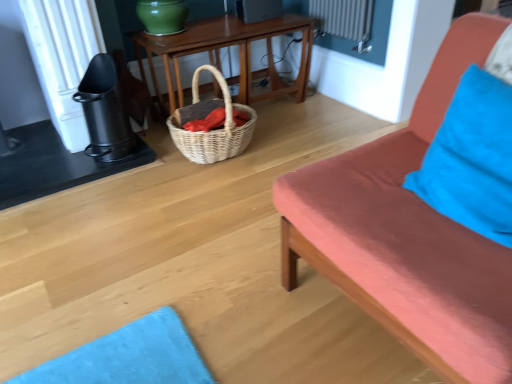
You are a GUI agent. You are given a task and a screenshot of the screen. Output one action in this format:
    pyautogui.click(x=<x>, y=<y>)
    Task: Click on the woven wicker basket at center
    The height and width of the screenshot is (384, 512).
    Given the screenshot: What is the action you would take?
    pyautogui.click(x=203, y=117)

Find the location of a particular element. woven natural picnic basket at center is located at coordinates (214, 131).

At what (x,y) coordinates should I click in order to perform the action: click on woven wood table at center. Please return your answer as a coordinate pair (x, y). The width and height of the screenshot is (512, 384). Looking at the image, I should click on (219, 55).

Image resolution: width=512 pixels, height=384 pixels. I want to click on matte coral studio couch at right, so click(408, 234).

I want to click on blue fabric pillow at right, so click(472, 158).

Is woven wood table at center to the left of woven wicker basket at center from the viewer's perspective?

Incorrect, woven wood table at center is not on the left side of woven wicker basket at center.

From a real-world perspective, which object rests below the other?

woven wicker basket at center is physically lower.

Considering the positions of points (302, 26) and (241, 117), is point (302, 26) farther from camera compared to point (241, 117)?

Yes, it is.

Is woven natural picnic basket at center inside the boundaries of woven wicker basket at center, or outside?

woven natural picnic basket at center is outside woven wicker basket at center.

In the image, is woven natural picnic basket at center on the left side or the right side of woven wicker basket at center?

woven natural picnic basket at center is positioned on woven wicker basket at center's left side.

In the scene shown: Who is more distant, woven natural picnic basket at center or woven wicker basket at center?

woven wicker basket at center is further away from the camera.

Find the location of a particular element. material located on the right of woven natural picnic basket at center is located at coordinates (203, 117).

Can you confirm if blue fabric pillow at right is taller than woven wood table at center?

Incorrect, the height of blue fabric pillow at right is not larger of that of woven wood table at center.

Is blue fabric pillow at right bigger than woven wood table at center?

No, blue fabric pillow at right is not bigger than woven wood table at center.

Is blue fabric pillow at right turned away from woven wood table at center?

That's not correct — blue fabric pillow at right is not looking away from woven wood table at center.

Identify the location of table behind the blue fabric pillow at right. (219, 55).

From a real-world perspective, is woven natural picnic basket at center over blue fabric pillow at right?

Incorrect, from a real-world perspective, woven natural picnic basket at center is lower than blue fabric pillow at right.

Which point is more forward, (215, 145) or (416, 178)?

Positioned in front is point (416, 178).

Does woven natural picnic basket at center turn towards blue fabric pillow at right?

Yes, woven natural picnic basket at center is facing blue fabric pillow at right.

Based on the photo, from the image's perspective, which is above, woven natural picnic basket at center or blue fabric pillow at right?

woven natural picnic basket at center, from the image's perspective.

Is blue fabric pillow at right oriented towards matte coral studio couch at right?

Yes, blue fabric pillow at right is oriented towards matte coral studio couch at right.

Is blue fabric pillow at right inside the boundaries of matte coral studio couch at right, or outside?

blue fabric pillow at right is spatially positioned inside matte coral studio couch at right.

Consider the image. From a real-world perspective, is blue fabric pillow at right on matte coral studio couch at right?

Yes, from a real-world perspective, blue fabric pillow at right is above matte coral studio couch at right.

Would you say matte coral studio couch at right is part of woven natural picnic basket at center's contents?

No, matte coral studio couch at right is not inside woven natural picnic basket at center.

Is woven natural picnic basket at center at the left side of matte coral studio couch at right?

Yes, woven natural picnic basket at center is to the left of matte coral studio couch at right.

Could you tell me if woven natural picnic basket at center is turned towards matte coral studio couch at right?

Yes, woven natural picnic basket at center faces towards matte coral studio couch at right.

Considering the relative sizes of woven natural picnic basket at center and matte coral studio couch at right in the image provided, is woven natural picnic basket at center taller than matte coral studio couch at right?

Incorrect, the height of woven natural picnic basket at center is not larger of that of matte coral studio couch at right.

Are matte coral studio couch at right and blue fabric pillow at right located far from each other?

That's not correct — matte coral studio couch at right is a little close to blue fabric pillow at right.

Based on the photo, from the image's perspective, who appears lower, matte coral studio couch at right or blue fabric pillow at right?

From the image's view, matte coral studio couch at right is below.

Between matte coral studio couch at right and blue fabric pillow at right, which one has larger size?

With larger size is matte coral studio couch at right.

Can you confirm if matte coral studio couch at right is wider than blue fabric pillow at right?

Yes.

You are a GUI agent. You are given a task and a screenshot of the screen. Output one action in this format:
    pyautogui.click(x=<x>, y=<y>)
    Task: Click on the table located above the woven wicker basket at center (from a real-world perspective)
    This screenshot has height=384, width=512.
    Given the screenshot: What is the action you would take?
    pyautogui.click(x=219, y=55)

Identify the location of material behind the woven natural picnic basket at center. Image resolution: width=512 pixels, height=384 pixels. (203, 117).

In the scene shown: Looking at the image, which one is located further to woven natural picnic basket at center, matte coral studio couch at right or woven wood table at center?

matte coral studio couch at right is positioned further to the anchor woven natural picnic basket at center.

Looking at the image, which one is located further to woven wicker basket at center, woven natural picnic basket at center or woven wood table at center?

Based on the image, woven wood table at center appears to be further to woven wicker basket at center.

Looking at the image, which one is located closer to matte coral studio couch at right, woven wood table at center or woven wicker basket at center?

The object closer to matte coral studio couch at right is woven wicker basket at center.

Looking at the image, which one is located further to blue fabric pillow at right, woven wicker basket at center or woven natural picnic basket at center?

woven wicker basket at center is positioned further to the anchor blue fabric pillow at right.

Considering their positions, is matte coral studio couch at right positioned closer to woven wood table at center than woven natural picnic basket at center?

woven natural picnic basket at center is positioned closer to the anchor woven wood table at center.

Which object lies further to the anchor point woven natural picnic basket at center, blue fabric pillow at right or woven wicker basket at center?

blue fabric pillow at right is further to woven natural picnic basket at center.

Looking at this image, from the image, which object appears to be nearer to woven wicker basket at center, matte coral studio couch at right or woven natural picnic basket at center?

woven natural picnic basket at center.

Based on their spatial positions, is woven wood table at center or woven natural picnic basket at center closer to blue fabric pillow at right?

woven natural picnic basket at center is closer to blue fabric pillow at right.

The height and width of the screenshot is (384, 512). What are the coordinates of `pillow between matte coral studio couch at right and woven natural picnic basket at center along the z-axis` in the screenshot? It's located at (472, 158).

The height and width of the screenshot is (384, 512). In order to click on picnic basket between matte coral studio couch at right and woven wicker basket at center from front to back in this screenshot , I will do `click(214, 131)`.

You are a GUI agent. You are given a task and a screenshot of the screen. Output one action in this format:
    pyautogui.click(x=<x>, y=<y>)
    Task: Click on the picnic basket that lies between woven wood table at center and woven wicker basket at center from top to bottom
    The height and width of the screenshot is (384, 512).
    Given the screenshot: What is the action you would take?
    pyautogui.click(x=214, y=131)

This screenshot has width=512, height=384. I want to click on picnic basket between matte coral studio couch at right and woven wood table at center from front to back, so click(214, 131).